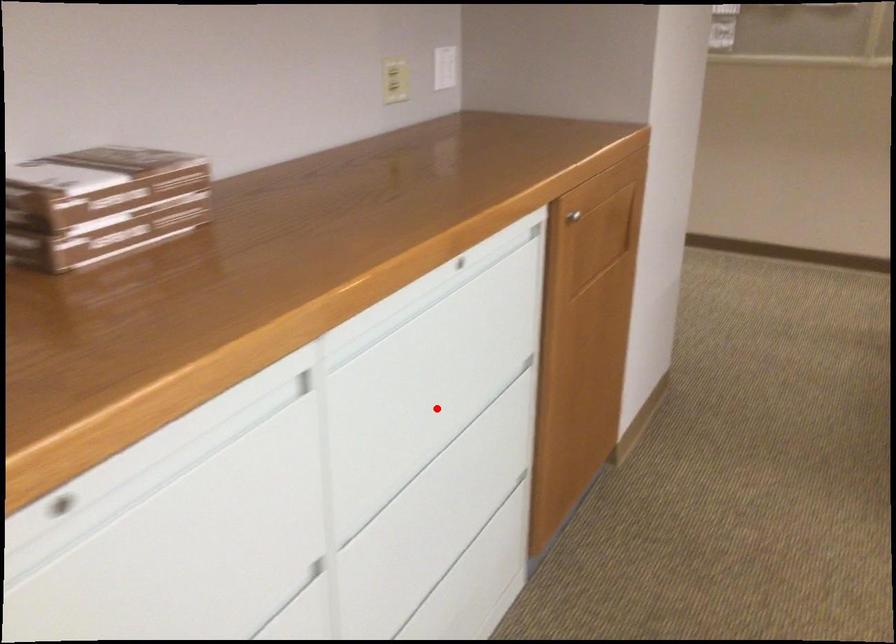
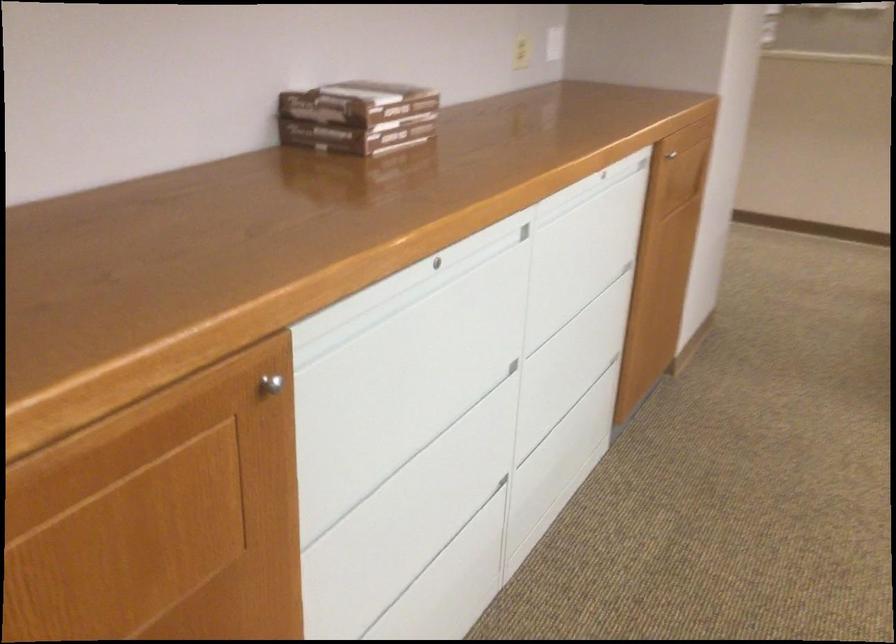
Question: A red point is marked in image1. In image2, is the corresponding 3D point closer to the camera or farther? Reply with the corresponding letter.

Choices:
 (A) The corresponding 3D point is closer.
 (B) The corresponding 3D point is farther.

Answer: (B)